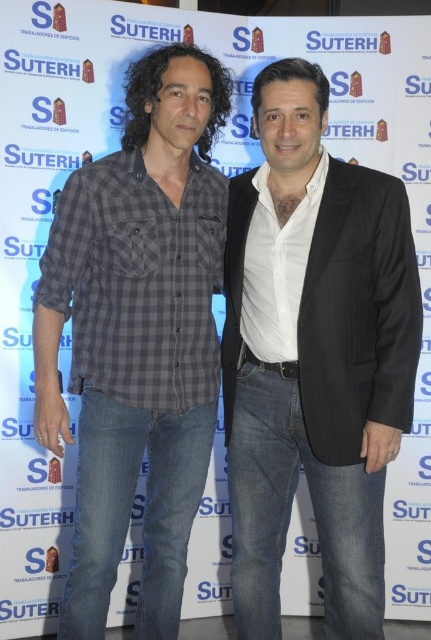
Question: Does white smooth shirt at center have a lesser width compared to gray checkered shirt at center?

Choices:
 (A) no
 (B) yes

Answer: (B)

Question: Which point is closer to the camera?

Choices:
 (A) white smooth shirt at center
 (B) gray checkered shirt at center

Answer: (B)

Question: Where is white smooth shirt at center located in relation to gray checkered shirt at center in the image?

Choices:
 (A) right
 (B) left

Answer: (A)

Question: Can you confirm if white smooth shirt at center is positioned above gray checkered shirt at center?

Choices:
 (A) yes
 (B) no

Answer: (B)